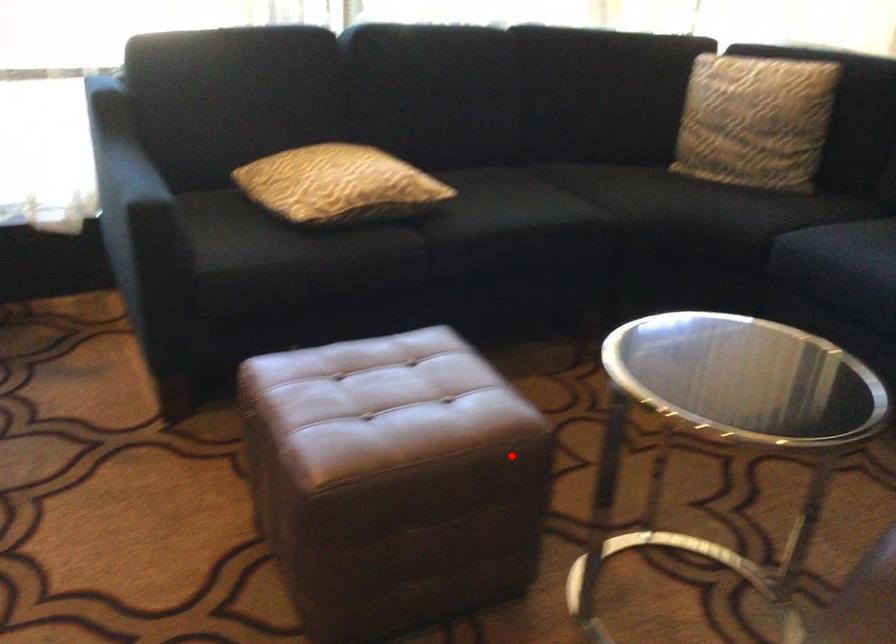
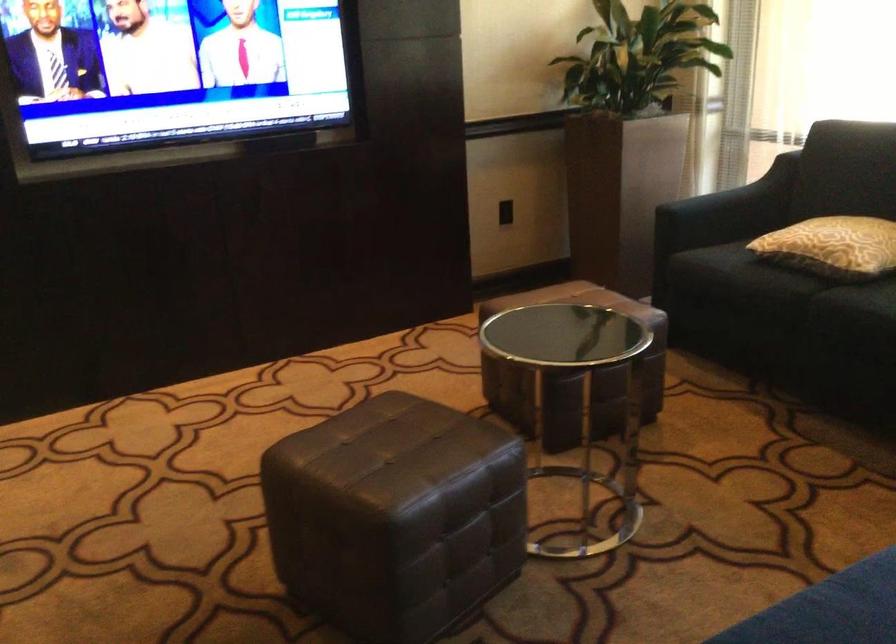
Question: I am providing you with two images of the same scene from different viewpoints. In image1, a red point is highlighted. Considering the same 3D point in image2, which of the following is correct?

Choices:
 (A) It is closer
 (B) It is farther

Answer: (B)